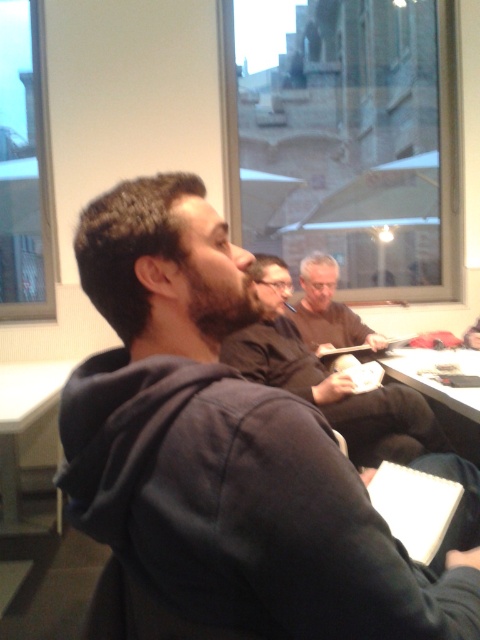
Question: From the image, what is the correct spatial relationship of gray hair man at center in relation to white paper at center?

Choices:
 (A) above
 (B) below

Answer: (A)

Question: Among these points, which one is farthest from the camera?

Choices:
 (A) (11, 433)
 (B) (265, 570)
 (C) (446, 401)

Answer: (A)

Question: Which point is closer to the camera?

Choices:
 (A) (340, 433)
 (B) (227, 573)
 (C) (411, 364)

Answer: (B)

Question: Which point is closer to the camera taking this photo?

Choices:
 (A) (276, 310)
 (B) (314, 266)

Answer: (A)

Question: Can you confirm if black hoodie at center is positioned above white paper at center?

Choices:
 (A) no
 (B) yes

Answer: (B)

Question: Can you confirm if white plastic table at lower left is positioned to the left of gray hair man at center?

Choices:
 (A) yes
 (B) no

Answer: (A)